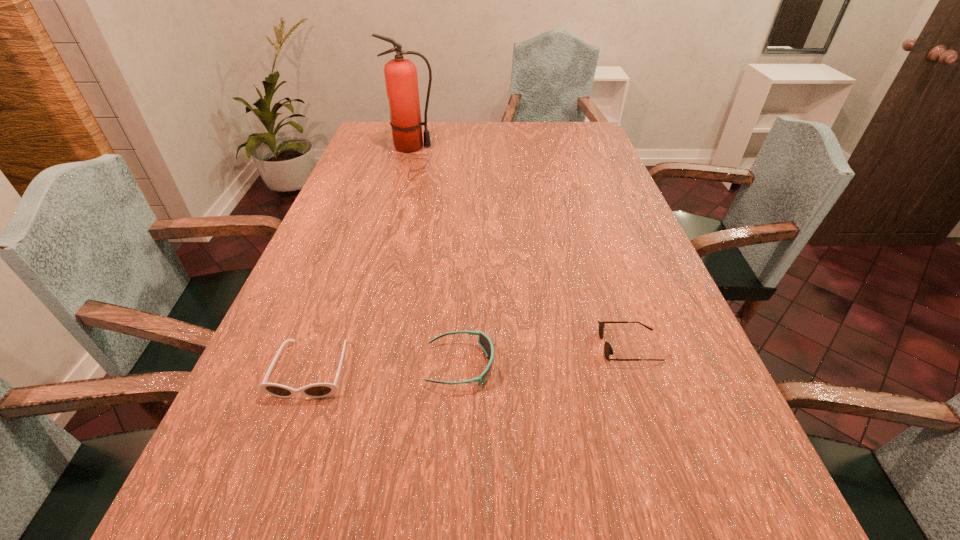
The image size is (960, 540). I want to click on free region at the far right corner, so click(599, 140).

At what (x,y) coordinates should I click in order to perform the action: click on free space between the fire extinguisher and the second object from right to left. Please return your answer as a coordinate pair (x, y). The image size is (960, 540). Looking at the image, I should click on (436, 256).

At what (x,y) coordinates should I click in order to perform the action: click on vacant region between the shortest sunglasses and the tallest object. Please return your answer as a coordinate pair (x, y). Looking at the image, I should click on (521, 247).

At what (x,y) coordinates should I click in order to perform the action: click on unoccupied position between the leftmost sunglasses and the farthest object. Please return your answer as a coordinate pair (x, y). Looking at the image, I should click on (362, 259).

I want to click on empty location between the leftmost sunglasses and the second sunglasses from right to left, so click(386, 367).

Image resolution: width=960 pixels, height=540 pixels. Find the location of `vacant space that's between the leftmost sunglasses and the second object from right to left`. vacant space that's between the leftmost sunglasses and the second object from right to left is located at coordinates (386, 367).

The width and height of the screenshot is (960, 540). I want to click on free spot between the shortest object and the fire extinguisher, so click(x=521, y=247).

You are a GUI agent. You are given a task and a screenshot of the screen. Output one action in this format:
    pyautogui.click(x=<x>, y=<y>)
    Task: Click on the vacant space that's between the leftmost sunglasses and the rightmost sunglasses
    The height and width of the screenshot is (540, 960).
    Given the screenshot: What is the action you would take?
    pyautogui.click(x=470, y=358)

I want to click on free space that is in between the rightmost object and the leftmost sunglasses, so click(470, 358).

Where is `free space between the tallest object and the shortest object`? This screenshot has width=960, height=540. free space between the tallest object and the shortest object is located at coordinates (521, 247).